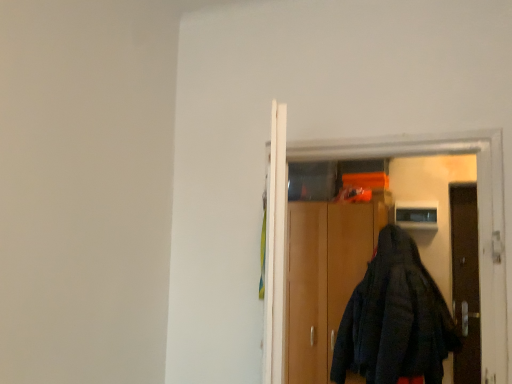
Question: From a real-world perspective, is black fabric coat at center under wooden cabinet at center?

Choices:
 (A) yes
 (B) no

Answer: (B)

Question: From the image's perspective, is black fabric coat at center above wooden cabinet at center?

Choices:
 (A) yes
 (B) no

Answer: (A)

Question: From a real-world perspective, is black fabric coat at center physically above wooden cabinet at center?

Choices:
 (A) no
 (B) yes

Answer: (B)

Question: Is black fabric coat at center shorter than wooden cabinet at center?

Choices:
 (A) no
 (B) yes

Answer: (B)

Question: Is black fabric coat at center facing away from wooden cabinet at center?

Choices:
 (A) yes
 (B) no

Answer: (A)

Question: Is black fabric coat at center aimed at wooden cabinet at center?

Choices:
 (A) yes
 (B) no

Answer: (B)

Question: Would you consider wooden cabinet at center to be distant from black fabric coat at center?

Choices:
 (A) no
 (B) yes

Answer: (B)

Question: Is wooden cabinet at center looking in the opposite direction of black fabric coat at center?

Choices:
 (A) yes
 (B) no

Answer: (B)

Question: Is wooden cabinet at center in front of black fabric coat at center?

Choices:
 (A) yes
 (B) no

Answer: (B)

Question: Does wooden cabinet at center appear on the right side of black fabric coat at center?

Choices:
 (A) yes
 (B) no

Answer: (A)

Question: Does wooden cabinet at center lie behind black fabric coat at center?

Choices:
 (A) no
 (B) yes

Answer: (B)

Question: Is wooden cabinet at center wider than black fabric coat at center?

Choices:
 (A) yes
 (B) no

Answer: (A)

Question: Considering the positions of wooden cabinet at center and black fabric coat at center in the image, is wooden cabinet at center bigger or smaller than black fabric coat at center?

Choices:
 (A) small
 (B) big

Answer: (B)